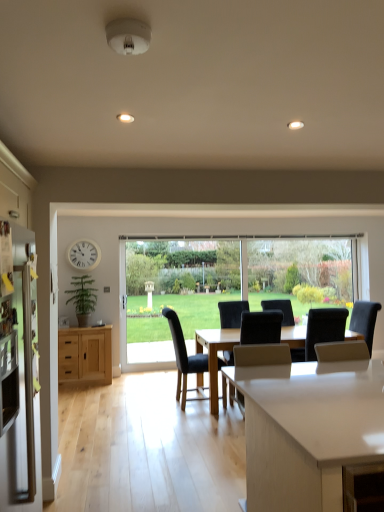
Question: From the image's perspective, relative to satin stainless steel refrigerator at left, is dark blue fabric chair at center, acting as the 2th chair starting from the right, above or below?

Choices:
 (A) above
 (B) below

Answer: (B)

Question: In terms of height, does dark blue fabric chair at center, acting as the 2th chair starting from the right, look taller or shorter compared to satin stainless steel refrigerator at left?

Choices:
 (A) short
 (B) tall

Answer: (A)

Question: Which object is positioned closest to the white plastic clock at upper left?

Choices:
 (A) black fabric chair at center, which ranks as the third chair in left-to-right order
 (B) satin stainless steel refrigerator at left
 (C) black leather chair at center, which ranks as the third chair in right-to-left order
 (D) dark blue fabric chair at center, the 2th chair from the left
 (E) white glossy countertop at center

Answer: (C)

Question: Estimate the real-world distances between objects in this image. Which object is closer to the white glossy countertop at center?

Choices:
 (A) white plastic clock at upper left
 (B) natural wood cabinet at left
 (C) green matte plant at left
 (D) satin stainless steel refrigerator at left
 (E) black leather chair at center, which ranks as the third chair in right-to-left order

Answer: (D)